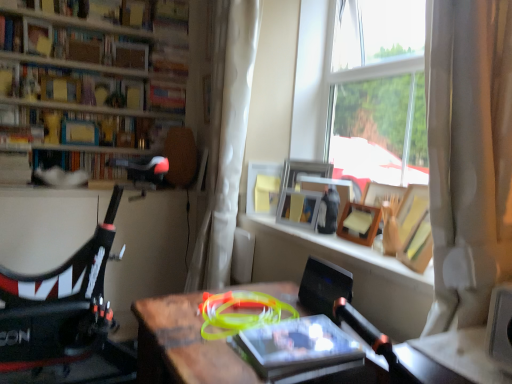
The width and height of the screenshot is (512, 384). What do you see at coordinates (85, 121) in the screenshot?
I see `matte yellow book at upper left, which appears as the 3th book when ordered from the bottom` at bounding box center [85, 121].

In order to face matte yellow book at upper left, arranged as the third book when viewed from the back, should I rotate leftwards or rightwards?

Rotate your view left by about 21.385°.

This screenshot has height=384, width=512. What do you see at coordinates (69, 86) in the screenshot?
I see `matte yellow book at upper left, the 5th book when ordered from bottom to top` at bounding box center [69, 86].

This screenshot has width=512, height=384. What do you see at coordinates (226, 138) in the screenshot?
I see `white sheer curtain at center` at bounding box center [226, 138].

At what (x,y) coordinates should I click in order to perform the action: click on matte white picture frame at center, the 4th picture frame positioned from the right. Please return your answer as a coordinate pair (x, y). Image resolution: width=512 pixels, height=384 pixels. Looking at the image, I should click on (263, 187).

Where is `matte black bookshelf at center, placed as the second book when sorted from bottom to top`? matte black bookshelf at center, placed as the second book when sorted from bottom to top is located at coordinates (83, 162).

What do you see at coordinates (182, 345) in the screenshot? I see `wooden desk at center` at bounding box center [182, 345].

Where is `matte yellow book at upper left, which appears as the 3th book when ordered from the bottom`? The height and width of the screenshot is (384, 512). matte yellow book at upper left, which appears as the 3th book when ordered from the bottom is located at coordinates (85, 121).

Are matte yellow book at upper left, the 5th book when ordered from bottom to top, and matte white picture frame at center, the 4th picture frame positioned from the right, beside each other?

They are not placed beside each other.

Can you tell me how much matte yellow book at upper left, the 1th book when ordered from top to bottom, and matte white picture frame at center, which is the 1th picture frame in left-to-right order, differ in facing direction?

18.9 degrees separate the facing orientations of matte yellow book at upper left, the 1th book when ordered from top to bottom, and matte white picture frame at center, which is the 1th picture frame in left-to-right order.

Considering their positions, is matte yellow book at upper left, the 2th book in the front-to-back sequence, located in front of or behind matte white picture frame at center, which is the 1th picture frame in left-to-right order?

matte yellow book at upper left, the 2th book in the front-to-back sequence, is positioned farther from the viewer than matte white picture frame at center, which is the 1th picture frame in left-to-right order.

Is matte yellow book at upper left, the 2th book in the front-to-back sequence, not within matte white picture frame at center, the 4th picture frame positioned from the right?

Yes.

Considering the relative positions of translucent plastic book at center, which is the 5th book in back-to-front order, and matte black bookshelf at center, placed as the second book when sorted from bottom to top, in the image provided, is translucent plastic book at center, which is the 5th book in back-to-front order, to the left of matte black bookshelf at center, placed as the second book when sorted from bottom to top, from the viewer's perspective?

No, translucent plastic book at center, which is the 5th book in back-to-front order, is not to the left of matte black bookshelf at center, placed as the second book when sorted from bottom to top.

Between translucent plastic book at center, the 1th book in the front-to-back sequence, and matte black bookshelf at center, the fourth book viewed from the front, which one has smaller width?

With smaller width is matte black bookshelf at center, the fourth book viewed from the front.

Is point (360, 349) farther from viewer compared to point (106, 169)?

No, it is not.

What's the angular difference between translucent plastic book at center, the 1th book in the front-to-back sequence, and matte black bookshelf at center, the 4th book in the top-to-bottom sequence,'s facing directions?

There is a 90-degree angle between the facing directions of translucent plastic book at center, the 1th book in the front-to-back sequence, and matte black bookshelf at center, the 4th book in the top-to-bottom sequence.

Visually, is white sheer curtain at center positioned to the left or to the right of matte yellow book at upper left, acting as the third book starting from the front?

In the image, white sheer curtain at center appears on the right side of matte yellow book at upper left, acting as the third book starting from the front.

Is point (228, 147) closer or farther from the camera than point (162, 117)?

Point (228, 147) appears to be closer to the viewer than point (162, 117).

Does white sheer curtain at center have a larger size compared to matte yellow book at upper left, acting as the 3th book starting from the top?

Yes, white sheer curtain at center is bigger than matte yellow book at upper left, acting as the 3th book starting from the top.

From a real-world perspective, is white sheer curtain at center physically below matte yellow book at upper left, acting as the third book starting from the front?

Yes.

What's the angular difference between matte black bookshelf at center, the fourth book viewed from the front, and matte yellow book at upper left, the 1th book when ordered from top to bottom,'s facing directions?

They differ by 0.00743 degrees in their facing directions.

Is matte black bookshelf at center, the fourth book viewed from the front, behind matte yellow book at upper left, the 2th book in the front-to-back sequence?

That is True.

Is matte black bookshelf at center, the fourth book viewed from the front, positioned with its back to matte yellow book at upper left, the fourth book viewed from the back?

That's not correct — matte black bookshelf at center, the fourth book viewed from the front, is not looking away from matte yellow book at upper left, the fourth book viewed from the back.

Is matte black bookshelf at center, placed as the second book when sorted from bottom to top, outside of matte yellow book at upper left, the fourth book viewed from the back?

Yes, matte black bookshelf at center, placed as the second book when sorted from bottom to top, is outside of matte yellow book at upper left, the fourth book viewed from the back.

Is matte yellow book at upper left, acting as the 3th book starting from the top, in front of or behind hardcover book at upper center, the 1th book from the back, in the image?

Visually, matte yellow book at upper left, acting as the 3th book starting from the top, is located in front of hardcover book at upper center, the 1th book from the back.

From a real-world perspective, is matte yellow book at upper left, acting as the 3th book starting from the top, above or below hardcover book at upper center, marked as the 2th book in a top-to-bottom arrangement?

From a real-world perspective, matte yellow book at upper left, acting as the 3th book starting from the top, is physically below hardcover book at upper center, marked as the 2th book in a top-to-bottom arrangement.

Which of these two, matte yellow book at upper left, arranged as the third book when viewed from the back, or hardcover book at upper center, the 1th book from the back, is wider?

hardcover book at upper center, the 1th book from the back.

Can you confirm if white sheer curtain at center is positioned to the left of translucent plastic book at center, which is the fifth book in top-to-bottom order?

Indeed, white sheer curtain at center is positioned on the left side of translucent plastic book at center, which is the fifth book in top-to-bottom order.

Would you say white sheer curtain at center is outside translucent plastic book at center, which is the 1th book from bottom to top?

white sheer curtain at center lies outside translucent plastic book at center, which is the 1th book from bottom to top,'s area.

From the image's perspective, between white sheer curtain at center and translucent plastic book at center, which is the fifth book in top-to-bottom order, who is located below?

translucent plastic book at center, which is the fifth book in top-to-bottom order, from the image's perspective.

Is point (147, 141) closer or farther from the camera than point (38, 84)?

Point (147, 141) appears to be farther away from the viewer than point (38, 84).

Identify the location of the 1st book in front of the matte yellow book at upper left, acting as the 3th book starting from the top. The image size is (512, 384). (69, 86).

Looking at this image, which object is more forward, matte yellow book at upper left, which appears as the 3th book when ordered from the bottom, or matte yellow book at upper left, the 5th book when ordered from bottom to top?

Positioned in front is matte yellow book at upper left, the 5th book when ordered from bottom to top.

Measure the distance between matte yellow book at upper left, which appears as the 3th book when ordered from the bottom, and matte yellow book at upper left, the fourth book viewed from the back.

The distance of matte yellow book at upper left, which appears as the 3th book when ordered from the bottom, from matte yellow book at upper left, the fourth book viewed from the back, is 14.79 centimeters.

Starting from the matte white picture frame at center, which is the 1th picture frame in left-to-right order, which book is the 1st one behind? Please provide its 2D coordinates.

[(69, 86)]

Which book is the 2nd one when counting from the left side of the translucent plastic book at center, the 1th book in the front-to-back sequence? Please provide its 2D coordinates.

[(83, 162)]

Considering their positions, is hardcover book at upper center, marked as the 2th book in a top-to-bottom arrangement, positioned further to matte yellow book at upper left, the fourth book viewed from the back, than wooden frame at upper center?

The object further to matte yellow book at upper left, the fourth book viewed from the back, is wooden frame at upper center.

Considering their positions, is wooden picture frame at window, the 4th picture frame positioned from the left, positioned further to wooden desk at center than wooden picture frame at window, which appears as the third picture frame when viewed from the left?

Based on the image, wooden picture frame at window, the 4th picture frame positioned from the left, appears to be further to wooden desk at center.

Considering their positions, is wooden picture frame at upper right, which is counted as the third picture frame, starting from the right, positioned closer to wooden frame at upper center than wooden picture frame at window, placed as the first picture frame when sorted from right to left?

The object closer to wooden frame at upper center is wooden picture frame at upper right, which is counted as the third picture frame, starting from the right.

Based on their spatial positions, is matte yellow book at upper left, the 1th book when ordered from top to bottom, or matte yellow book at upper left, arranged as the third book when viewed from the back, closer to matte black bookshelf at center, the fourth book viewed from the front?

matte yellow book at upper left, arranged as the third book when viewed from the back, is positioned closer to the anchor matte black bookshelf at center, the fourth book viewed from the front.

Consider the image. Considering their positions, is hardcover book at upper center, acting as the 5th book starting from the front, positioned closer to wooden frame at upper center than wooden picture frame at window, which is counted as the second picture frame, starting from the right?

wooden picture frame at window, which is counted as the second picture frame, starting from the right, is positioned closer to the anchor wooden frame at upper center.

From the image, which object appears to be nearer to translucent plastic book at center, which is the fifth book in top-to-bottom order, hardcover book at upper center, marked as the 2th book in a top-to-bottom arrangement, or wooden frame at upper center?

The object closer to translucent plastic book at center, which is the fifth book in top-to-bottom order, is wooden frame at upper center.

From the image, which object appears to be farther from matte yellow book at upper left, acting as the third book starting from the front, wooden picture frame at window, the 4th picture frame positioned from the left, or matte black bookshelf at center, placed as the second book when sorted from bottom to top?

Based on the image, wooden picture frame at window, the 4th picture frame positioned from the left, appears to be further to matte yellow book at upper left, acting as the third book starting from the front.

Based on their spatial positions, is matte yellow book at upper left, acting as the 3th book starting from the top, or wooden picture frame at window, which is counted as the second picture frame, starting from the right, further from matte white picture frame at center, which is the 1th picture frame in left-to-right order?

matte yellow book at upper left, acting as the 3th book starting from the top.

Where is `book between matte black bookshelf at center, the fourth book viewed from the front, and matte white picture frame at center, which is the 1th picture frame in left-to-right order, in the horizontal direction`? book between matte black bookshelf at center, the fourth book viewed from the front, and matte white picture frame at center, which is the 1th picture frame in left-to-right order, in the horizontal direction is located at coordinates (166, 96).

Find the location of `curtain located between matte yellow book at upper left, acting as the third book starting from the front, and wooden picture frame at window, which is counted as the second picture frame, starting from the right, in the left-right direction`. curtain located between matte yellow book at upper left, acting as the third book starting from the front, and wooden picture frame at window, which is counted as the second picture frame, starting from the right, in the left-right direction is located at coordinates (226, 138).

Locate an element on the screen. This screenshot has width=512, height=384. curtain located between matte yellow book at upper left, acting as the 3th book starting from the top, and matte white picture frame at center, the 4th picture frame positioned from the right, in the left-right direction is located at coordinates (226, 138).

Find the location of a particular element. The width and height of the screenshot is (512, 384). book between wooden desk at center and wooden picture frame at window, which is counted as the second picture frame, starting from the right, along the z-axis is located at coordinates (298, 349).